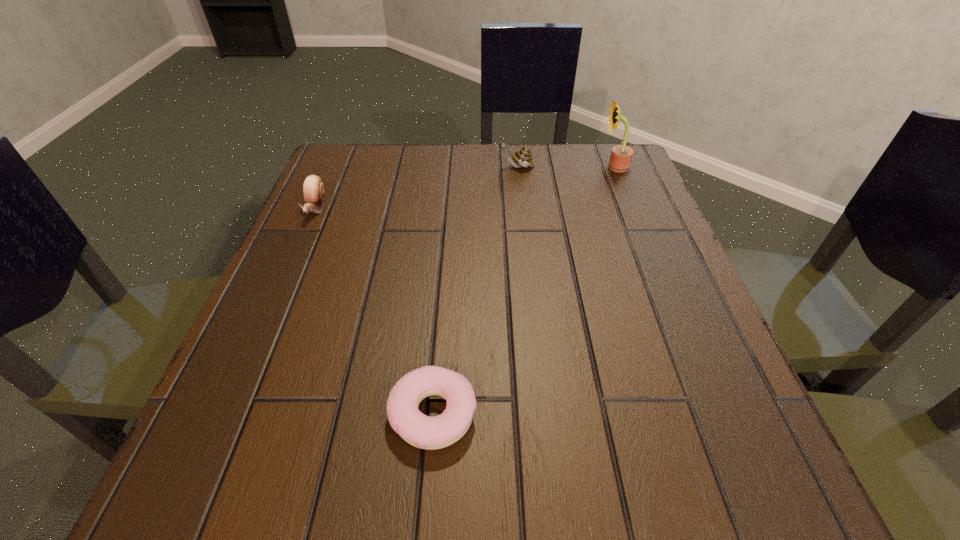
Locate an element on the screen. free spot between the second nearest object and the nearest object is located at coordinates (374, 311).

Locate an element on the screen. Image resolution: width=960 pixels, height=540 pixels. vacant area that lies between the third shortest object and the shortest object is located at coordinates (474, 291).

Image resolution: width=960 pixels, height=540 pixels. What are the coordinates of `empty location between the nearer escargot and the sunflower` in the screenshot? It's located at pos(465,187).

You are a GUI agent. You are given a task and a screenshot of the screen. Output one action in this format:
    pyautogui.click(x=<x>, y=<y>)
    Task: Click on the vacant area between the sunflower and the right escargot
    This screenshot has width=960, height=540.
    Given the screenshot: What is the action you would take?
    pyautogui.click(x=565, y=167)

Image resolution: width=960 pixels, height=540 pixels. What are the coordinates of `free space that is in between the rightmost object and the second object from right to left` in the screenshot? It's located at (565, 167).

You are a GUI agent. You are given a task and a screenshot of the screen. Output one action in this format:
    pyautogui.click(x=<x>, y=<y>)
    Task: Click on the empty space that is in between the rightmost object and the third object from left to right
    Image resolution: width=960 pixels, height=540 pixels.
    Given the screenshot: What is the action you would take?
    pyautogui.click(x=565, y=167)

Locate an element on the screen. The width and height of the screenshot is (960, 540). free point between the taller escargot and the shortest object is located at coordinates (474, 291).

Find the location of `vacant area between the third object from left to right and the leftmost object`. vacant area between the third object from left to right and the leftmost object is located at coordinates (416, 187).

At what (x,y) coordinates should I click in order to perform the action: click on vacant space in between the farther escargot and the nearest object. Please return your answer as a coordinate pair (x, y). Looking at the image, I should click on pyautogui.click(x=474, y=291).

Where is `the closest object to the third object from right to left`? This screenshot has height=540, width=960. the closest object to the third object from right to left is located at coordinates (313, 188).